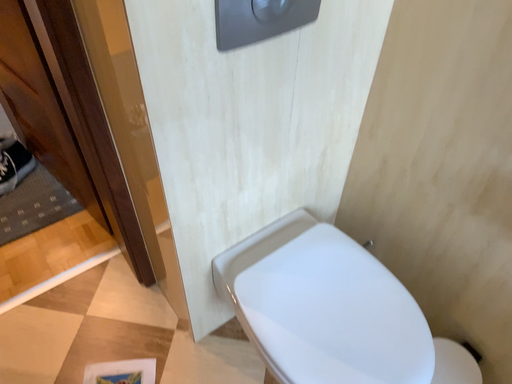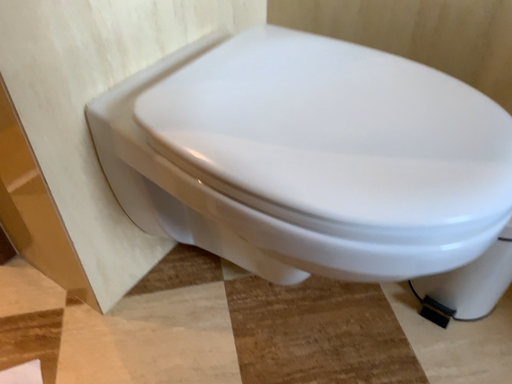
Question: How did the camera likely rotate when shooting the video?

Choices:
 (A) rotated left
 (B) rotated right

Answer: (B)